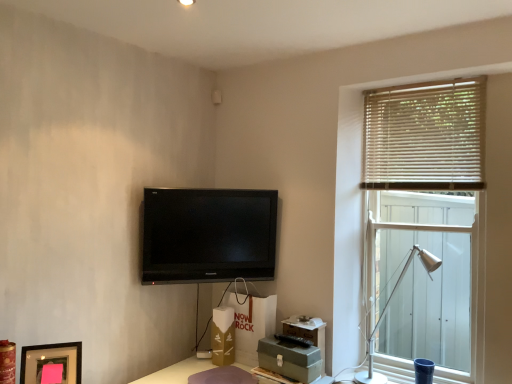
Question: Considering the relative sizes of black glossy tv at upper center and wooden blinds at right in the image provided, is black glossy tv at upper center taller than wooden blinds at right?

Choices:
 (A) no
 (B) yes

Answer: (A)

Question: Is black glossy tv at upper center thinner than wooden blinds at right?

Choices:
 (A) no
 (B) yes

Answer: (B)

Question: Does black glossy tv at upper center have a larger size compared to wooden blinds at right?

Choices:
 (A) yes
 (B) no

Answer: (B)

Question: Considering the relative sizes of black glossy tv at upper center and wooden blinds at right in the image provided, is black glossy tv at upper center shorter than wooden blinds at right?

Choices:
 (A) yes
 (B) no

Answer: (A)

Question: Considering the relative sizes of black glossy tv at upper center and wooden blinds at right in the image provided, is black glossy tv at upper center wider than wooden blinds at right?

Choices:
 (A) yes
 (B) no

Answer: (B)

Question: Is matte black picture frame at lower left wider or thinner than beige wooden blinds at upper right?

Choices:
 (A) wide
 (B) thin

Answer: (A)

Question: From a real-world perspective, is matte black picture frame at lower left physically located above or below beige wooden blinds at upper right?

Choices:
 (A) below
 (B) above

Answer: (A)

Question: From the image's perspective, relative to beige wooden blinds at upper right, is matte black picture frame at lower left above or below?

Choices:
 (A) above
 (B) below

Answer: (B)

Question: Considering the relative positions of matte black picture frame at lower left and beige wooden blinds at upper right in the image provided, is matte black picture frame at lower left to the left or to the right of beige wooden blinds at upper right?

Choices:
 (A) right
 (B) left

Answer: (B)

Question: Looking at their shapes, would you say matte black picture frame at lower left is wider or thinner than wooden blinds at right?

Choices:
 (A) wide
 (B) thin

Answer: (B)

Question: Based on their sizes in the image, would you say matte black picture frame at lower left is bigger or smaller than wooden blinds at right?

Choices:
 (A) big
 (B) small

Answer: (B)

Question: From their relative heights in the image, would you say matte black picture frame at lower left is taller or shorter than wooden blinds at right?

Choices:
 (A) tall
 (B) short

Answer: (B)

Question: Based on their positions, is matte black picture frame at lower left located to the left or right of wooden blinds at right?

Choices:
 (A) right
 (B) left

Answer: (B)

Question: Considering the positions of point (463, 162) and point (480, 120), is point (463, 162) closer or farther from the camera than point (480, 120)?

Choices:
 (A) closer
 (B) farther

Answer: (B)

Question: From the image's perspective, is wooden blinds at right above or below beige wooden blinds at upper right?

Choices:
 (A) above
 (B) below

Answer: (B)